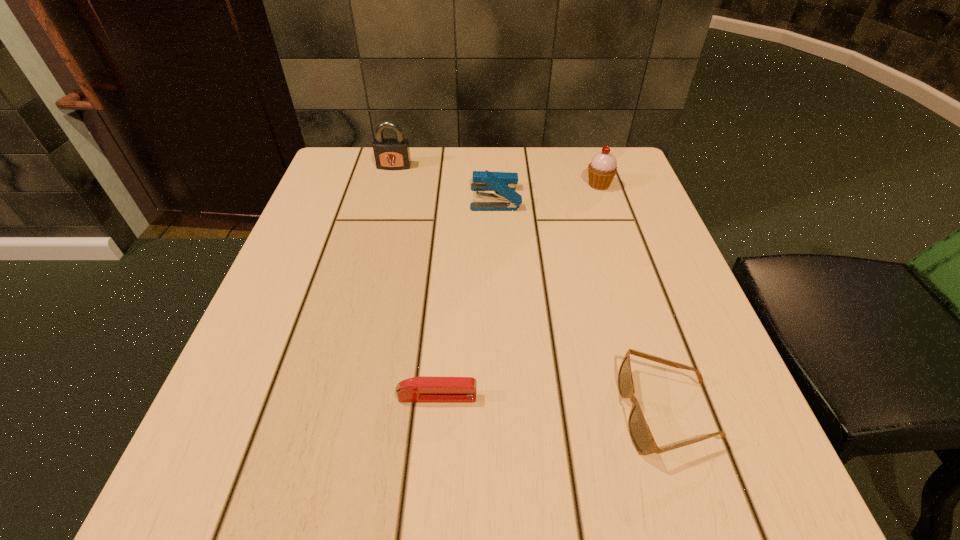
Identify the location of sunglasses located at the right edge. (640, 434).

Find the location of a particular element. This screenshot has width=960, height=540. object positioned at the far left corner is located at coordinates (390, 153).

Find the location of `object that is at the far right corner`. object that is at the far right corner is located at coordinates (603, 167).

At what (x,y) coordinates should I click in order to perform the action: click on object positioned at the near right corner. Please return your answer as a coordinate pair (x, y). This screenshot has height=540, width=960. Looking at the image, I should click on (640, 434).

At what (x,y) coordinates should I click in order to perform the action: click on vacant area at the far edge. Please return your answer as a coordinate pair (x, y). Looking at the image, I should click on (525, 183).

The image size is (960, 540). What are the coordinates of `vacant space at the near edge` in the screenshot? It's located at (358, 456).

This screenshot has width=960, height=540. I want to click on free space at the left edge of the desktop, so click(300, 376).

Locate an element on the screen. The height and width of the screenshot is (540, 960). free spot at the right edge of the desktop is located at coordinates (688, 436).

The image size is (960, 540). In the image, there is a desktop. In order to click on free space at the far left corner in this screenshot , I will do `click(383, 202)`.

The width and height of the screenshot is (960, 540). What are the coordinates of `free region at the near left corner of the desktop` in the screenshot? It's located at 217,447.